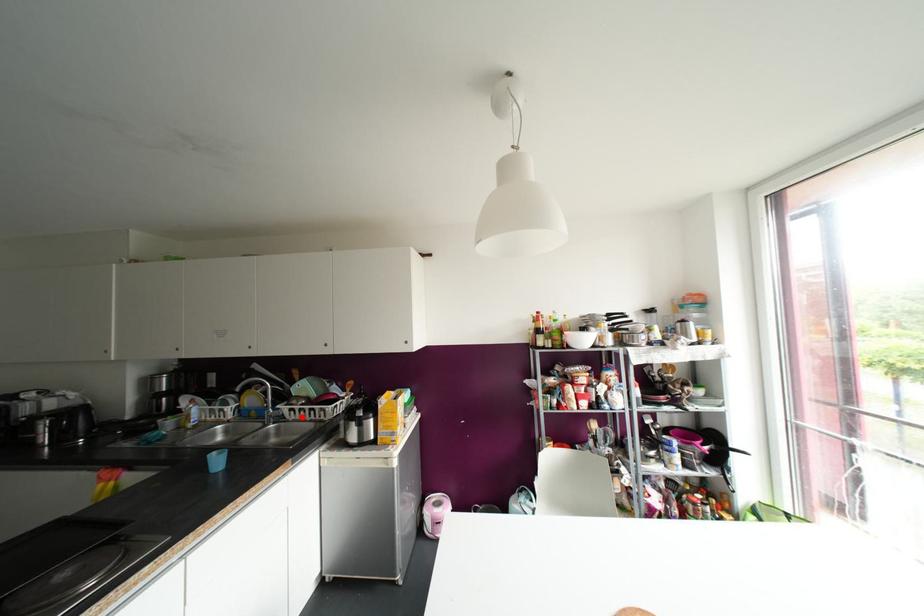
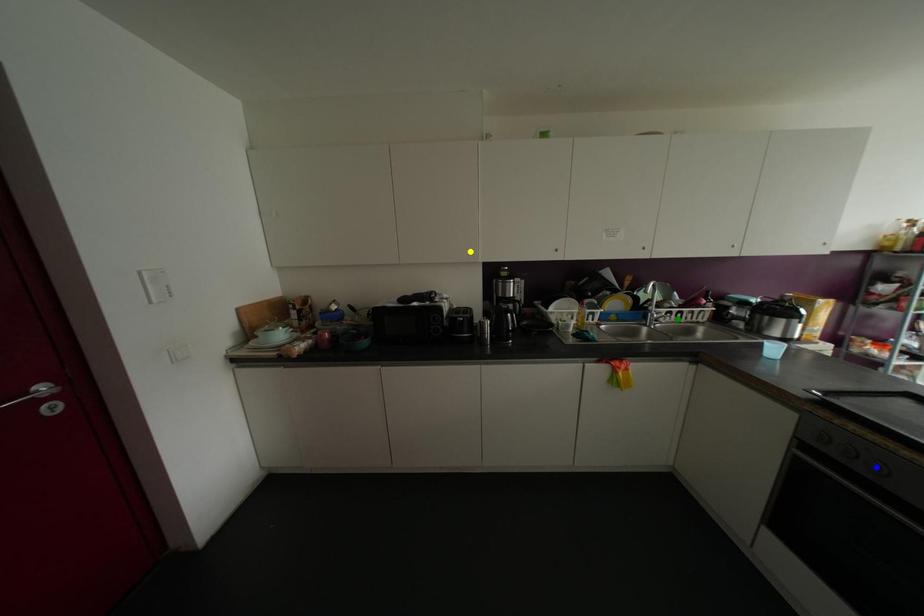
Question: I am providing you with two images of the same scene from different viewpoints. A red point is marked on the first image. You are given multiple points on the second image. Which point in image 2 represents the same 3d spot as the red point in image 1?

Choices:
 (A) yellow point
 (B) green point
 (C) blue point

Answer: (B)